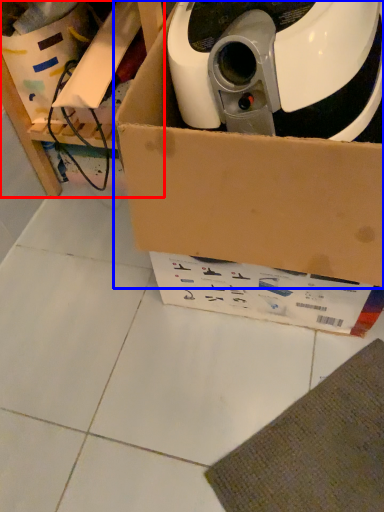
Question: Which of the following is the closest to the observer, furniture (highlighted by a red box) or box (highlighted by a blue box)?

Choices:
 (A) furniture
 (B) box

Answer: (B)